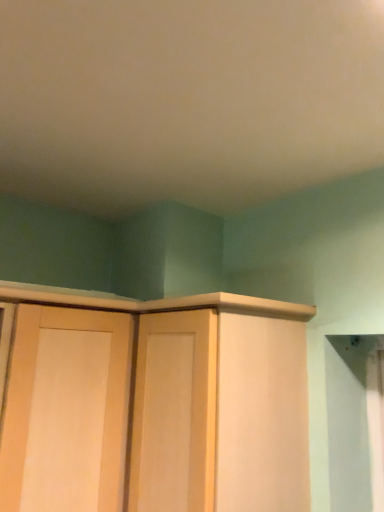
Question: Should I look upward or downward to see light wood door at center?

Choices:
 (A) up
 (B) down

Answer: (B)

Question: Is light wood door at center in front of light wood cabinet at center?

Choices:
 (A) yes
 (B) no

Answer: (B)

Question: Is light wood door at center wider than light wood cabinet at center?

Choices:
 (A) yes
 (B) no

Answer: (A)

Question: Can you confirm if light wood door at center is taller than light wood cabinet at center?

Choices:
 (A) no
 (B) yes

Answer: (B)

Question: Can you confirm if light wood door at center is positioned to the left of light wood cabinet at center?

Choices:
 (A) no
 (B) yes

Answer: (B)

Question: From a real-world perspective, does light wood door at center stand above light wood cabinet at center?

Choices:
 (A) no
 (B) yes

Answer: (A)

Question: From the image's perspective, is light wood door at center above light wood cabinet at center?

Choices:
 (A) no
 (B) yes

Answer: (A)

Question: Is light wood cabinet at center further to the viewer compared to light wood door at center?

Choices:
 (A) no
 (B) yes

Answer: (A)

Question: Is light wood cabinet at center not close to light wood door at center?

Choices:
 (A) no
 (B) yes

Answer: (A)

Question: Is light wood cabinet at center located outside light wood door at center?

Choices:
 (A) yes
 (B) no

Answer: (A)

Question: Would you say light wood door at center is part of light wood cabinet at center's contents?

Choices:
 (A) yes
 (B) no

Answer: (B)

Question: Can you confirm if light wood cabinet at center is smaller than light wood door at center?

Choices:
 (A) no
 (B) yes

Answer: (B)

Question: Does light wood cabinet at center have a larger size compared to light wood door at center?

Choices:
 (A) yes
 (B) no

Answer: (B)

Question: Is light wood door at center in front of or behind light wood cabinet at center in the image?

Choices:
 (A) behind
 (B) front

Answer: (A)